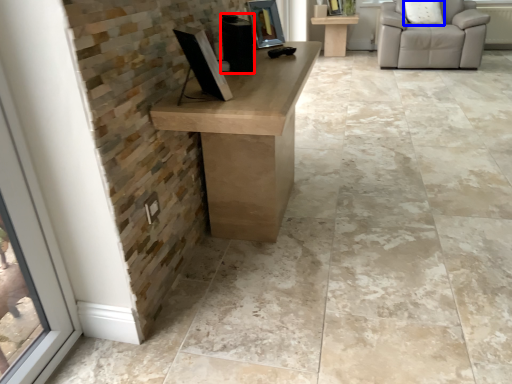
Question: Which of the following is the farthest to the observer, speaker (highlighted by a red box) or pillow (highlighted by a blue box)?

Choices:
 (A) speaker
 (B) pillow

Answer: (B)